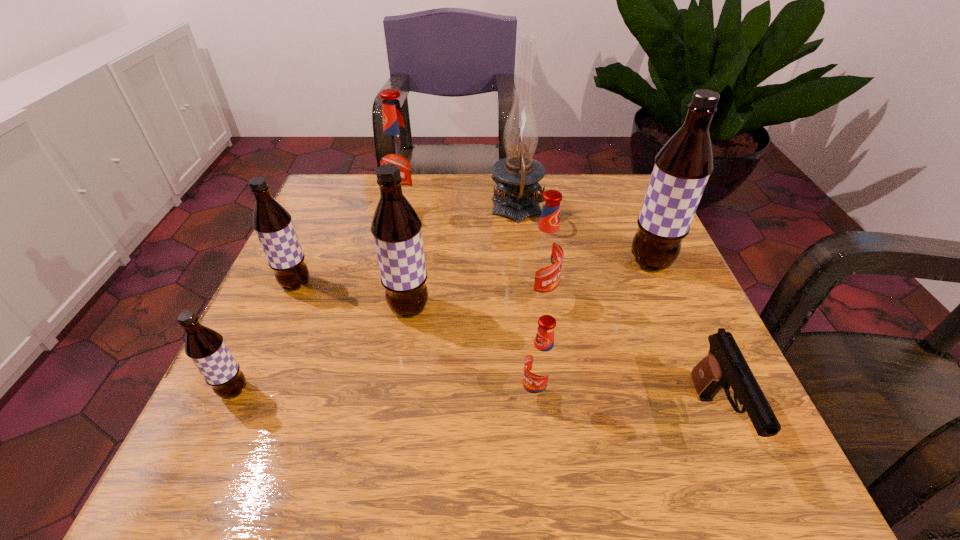
Locate an element on the screen. This screenshot has width=960, height=540. free location at the far left corner is located at coordinates (333, 212).

The width and height of the screenshot is (960, 540). I want to click on free space at the near left corner of the desktop, so click(x=186, y=474).

In the image, there is a desktop. At what (x,y) coordinates should I click in order to perform the action: click on vacant space at the far right corner. Please return your answer as a coordinate pair (x, y). Looking at the image, I should click on coord(639,212).

At what (x,y) coordinates should I click in order to perform the action: click on vacant space that is in between the second brown root beer from right to left and the second nearest red root beer. Please return your answer as a coordinate pair (x, y). The height and width of the screenshot is (540, 960). Looking at the image, I should click on (474, 303).

This screenshot has height=540, width=960. Find the location of `free area in between the second nearest red root beer and the smallest brown root beer`. free area in between the second nearest red root beer and the smallest brown root beer is located at coordinates (387, 344).

Locate an element on the screen. The width and height of the screenshot is (960, 540). blank region between the nearest brown root beer and the black pistol is located at coordinates (474, 404).

Image resolution: width=960 pixels, height=540 pixels. I want to click on blank region between the rightmost root beer and the oil lamp, so click(584, 237).

At what (x,y) coordinates should I click in order to perform the action: click on vacant space that's between the third biggest brown root beer and the rightmost brown root beer. Please return your answer as a coordinate pair (x, y). This screenshot has height=540, width=960. Looking at the image, I should click on (473, 273).

You are a GUI agent. You are given a task and a screenshot of the screen. Output one action in this format:
    pyautogui.click(x=<x>, y=<y>)
    Task: Click on the vacant space that's between the second nearest red root beer and the tallest root beer
    
    Given the screenshot: What is the action you would take?
    pyautogui.click(x=595, y=280)

Locate an element on the screen. The height and width of the screenshot is (540, 960). vacant region between the rightmost brown root beer and the second smallest brown root beer is located at coordinates (473, 273).